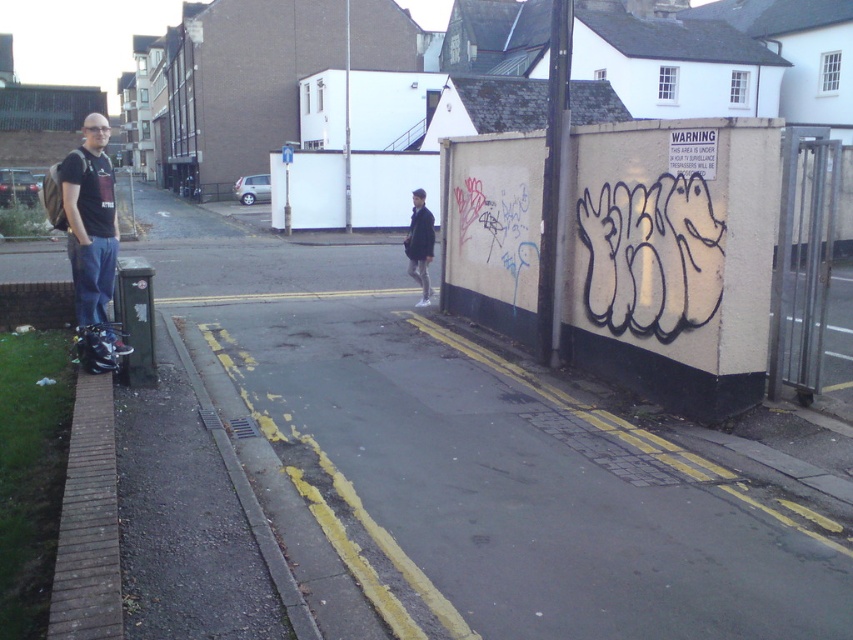
Who is shorter, matte black t-shirt at left or dark gray jacket at center?

matte black t-shirt at left

The image size is (853, 640). Identify the location of matte black t-shirt at left. (90, 220).

Describe the element at coordinates (90, 220) in the screenshot. I see `matte black t-shirt at left` at that location.

Locate an element on the screen. matte black t-shirt at left is located at coordinates (90, 220).